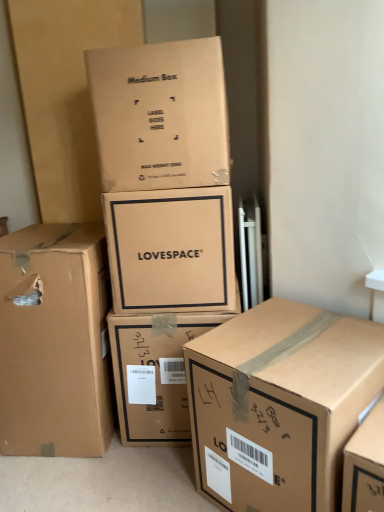
Question: Is brown cardboard box at upper center, arranged as the 2th box when viewed from the left, aimed at brown cardboard box at lower right, marked as the 5th box in a left-to-right arrangement?

Choices:
 (A) yes
 (B) no

Answer: (B)

Question: Considering the relative sizes of brown cardboard box at upper center, arranged as the 2th box when viewed from the left, and brown cardboard box at lower right, marked as the 5th box in a left-to-right arrangement, in the image provided, is brown cardboard box at upper center, arranged as the 2th box when viewed from the left, smaller than brown cardboard box at lower right, marked as the 5th box in a left-to-right arrangement,?

Choices:
 (A) no
 (B) yes

Answer: (B)

Question: Is brown cardboard box at upper center, arranged as the 2th box when viewed from the left, looking in the opposite direction of brown cardboard box at lower right, acting as the first box starting from the right?

Choices:
 (A) no
 (B) yes

Answer: (A)

Question: Is brown cardboard box at upper center, arranged as the 2th box when viewed from the left, at the left side of brown cardboard box at lower right, acting as the first box starting from the right?

Choices:
 (A) no
 (B) yes

Answer: (B)

Question: Is brown cardboard box at upper center, marked as the fourth box in a right-to-left arrangement, outside brown cardboard box at lower right, acting as the first box starting from the right?

Choices:
 (A) no
 (B) yes

Answer: (B)

Question: Is brown cardboard box at upper center, arranged as the 2th box when viewed from the left, shorter than brown cardboard box at lower right, marked as the 5th box in a left-to-right arrangement?

Choices:
 (A) yes
 (B) no

Answer: (A)

Question: Can you confirm if matte cardboard box at center, marked as the third box in a right-to-left arrangement, is positioned to the left of brown cardboard box at upper center, marked as the fourth box in a right-to-left arrangement?

Choices:
 (A) yes
 (B) no

Answer: (B)

Question: Is matte cardboard box at center, the third box positioned from the left, next to brown cardboard box at upper center, marked as the fourth box in a right-to-left arrangement?

Choices:
 (A) yes
 (B) no

Answer: (B)

Question: Considering the relative sizes of matte cardboard box at center, the third box positioned from the left, and brown cardboard box at upper center, arranged as the 2th box when viewed from the left, in the image provided, is matte cardboard box at center, the third box positioned from the left, taller than brown cardboard box at upper center, arranged as the 2th box when viewed from the left,?

Choices:
 (A) yes
 (B) no

Answer: (B)

Question: Can you confirm if matte cardboard box at center, the third box positioned from the left, is wider than brown cardboard box at upper center, arranged as the 2th box when viewed from the left?

Choices:
 (A) no
 (B) yes

Answer: (A)

Question: Does matte cardboard box at center, marked as the third box in a right-to-left arrangement, have a lesser width compared to brown cardboard box at upper center, marked as the fourth box in a right-to-left arrangement?

Choices:
 (A) no
 (B) yes

Answer: (B)

Question: Is brown cardboard box at upper center, marked as the fourth box in a right-to-left arrangement, located within matte cardboard box at center, marked as the third box in a right-to-left arrangement?

Choices:
 (A) no
 (B) yes

Answer: (A)

Question: Is brown cardboard box at lower right, marked as the 5th box in a left-to-right arrangement, positioned behind matte cardboard box at center, the third box positioned from the left?

Choices:
 (A) no
 (B) yes

Answer: (A)